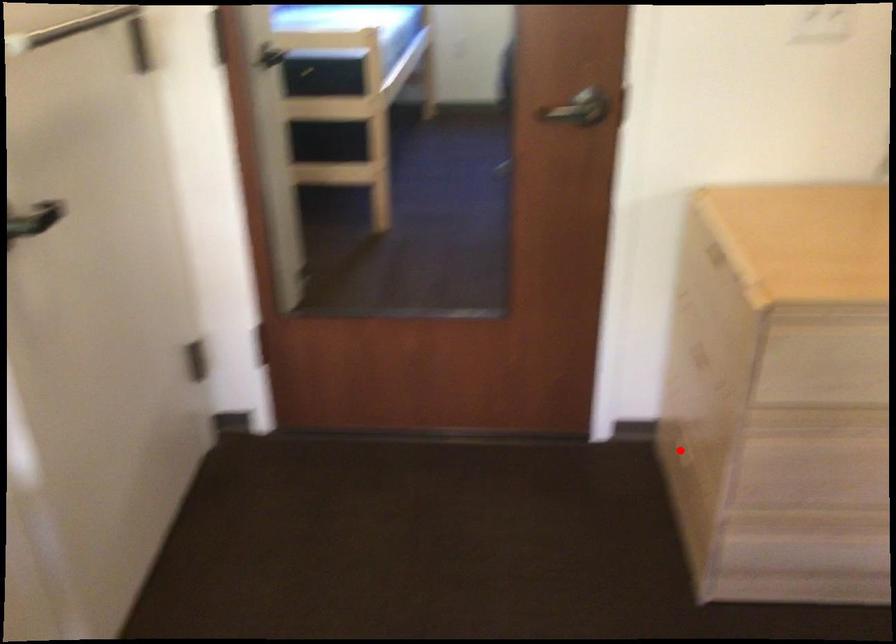
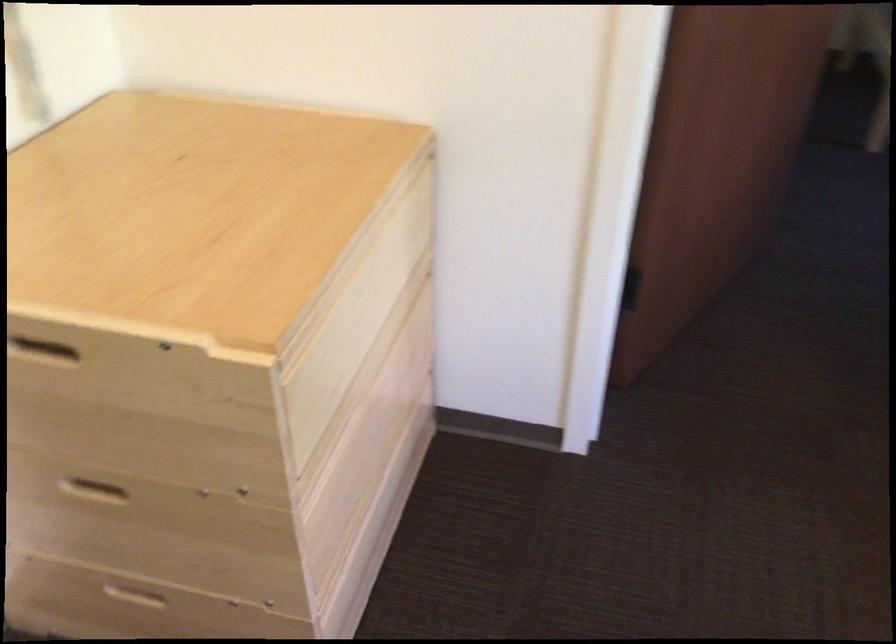
Find the pixel in the second image that matches the highlighted location in the first image.

(135, 600)